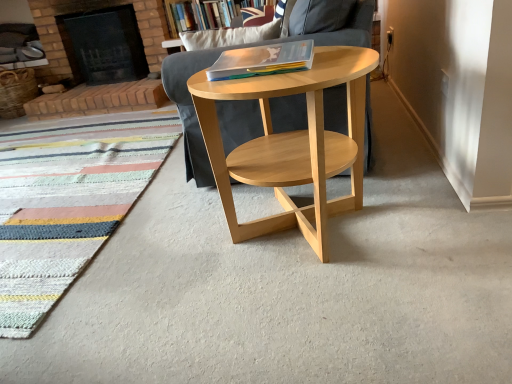
Measure the distance between natural wood chair at center and camera.

4.76 feet.

Where is `natural wood chair at center`? Image resolution: width=512 pixels, height=384 pixels. natural wood chair at center is located at coordinates (192, 105).

This screenshot has height=384, width=512. What do you see at coordinates (262, 61) in the screenshot?
I see `translucent plastic folder at center` at bounding box center [262, 61].

What is the approximate width of multicolored woven mat at lower left?

multicolored woven mat at lower left is 8.27 feet in width.

Describe the element at coordinates (104, 45) in the screenshot. The height and width of the screenshot is (384, 512). I see `brick fireplace at upper left` at that location.

This screenshot has height=384, width=512. I want to click on natural wood chair at center, so click(192, 105).

Can you confirm if multicolored woven mat at lower left is wider than brick fireplace at upper left?

Yes, multicolored woven mat at lower left is wider than brick fireplace at upper left.

Is the position of multicolored woven mat at lower left less distant than that of brick fireplace at upper left?

Yes, multicolored woven mat at lower left is closer to the camera.

Is multicolored woven mat at lower left next to brick fireplace at upper left?

No, multicolored woven mat at lower left is not next to brick fireplace at upper left.

Who is shorter, multicolored woven mat at lower left or brick fireplace at upper left?

multicolored woven mat at lower left is shorter.

Is point (189, 25) behind point (51, 167)?

That is False.

From a real-world perspective, which object stands above the other?

From a 3D spatial view, wooden bookshelf at upper center is above.

Considering the relative positions of wooden bookshelf at upper center and multicolored woven mat at lower left in the image provided, is wooden bookshelf at upper center behind multicolored woven mat at lower left?

That is True.

From the image's perspective, is wooden bookshelf at upper center located above or below multicolored woven mat at lower left?

Based on their image positions, wooden bookshelf at upper center is located above multicolored woven mat at lower left.

Based on the photo, how many degrees apart are the facing directions of natural wood chair at center and brick fireplace at upper left?

The angle between the facing direction of natural wood chair at center and the facing direction of brick fireplace at upper left is 90.2 degrees.

Is natural wood chair at center aimed at brick fireplace at upper left?

Yes, natural wood chair at center is facing brick fireplace at upper left.

At what (x,y) coordinates should I click in order to perform the action: click on fireplace behind the natural wood chair at center. Please return your answer as a coordinate pair (x, y). The height and width of the screenshot is (384, 512). Looking at the image, I should click on (104, 45).

How far apart are multicolored woven mat at lower left and wooden bookshelf at upper center?

They are 3.53 feet apart.

Which is more to the left, multicolored woven mat at lower left or wooden bookshelf at upper center?

Positioned to the left is multicolored woven mat at lower left.

From the image's perspective, is multicolored woven mat at lower left above or below wooden bookshelf at upper center?

From the image's perspective, multicolored woven mat at lower left appears below wooden bookshelf at upper center.

Which is in front, point (76, 155) or point (228, 6)?

The point (228, 6) is in front.

Is translucent plastic folder at center inside the boundaries of natural wood chair at center, or outside?

translucent plastic folder at center is located beyond the bounds of natural wood chair at center.

Locate an element on the screen. chair lying behind the translucent plastic folder at center is located at coordinates (192, 105).

Which object is positioned more to the right, translucent plastic folder at center or natural wood chair at center?

From the viewer's perspective, natural wood chair at center appears more on the right side.

Does natural wood chair at center have a greater width compared to wooden bookshelf at upper center?

Indeed, natural wood chair at center has a greater width compared to wooden bookshelf at upper center.

Considering the sizes of objects natural wood chair at center and wooden bookshelf at upper center in the image provided, who is bigger, natural wood chair at center or wooden bookshelf at upper center?

natural wood chair at center.

What are the coordinates of `chair below the wooden bookshelf at upper center (from a real-world perspective)` in the screenshot? It's located at (192, 105).

In the image, is natural wood chair at center positioned in front of or behind wooden bookshelf at upper center?

Clearly, natural wood chair at center is in front of wooden bookshelf at upper center.

Which of these two, natural wood chair at center or multicolored woven mat at lower left, is wider?

multicolored woven mat at lower left is wider.

From a real-world perspective, relative to multicolored woven mat at lower left, is natural wood chair at center vertically above or below?

From a real-world perspective, natural wood chair at center is physically above multicolored woven mat at lower left.

Where is `chair behind the multicolored woven mat at lower left`? This screenshot has width=512, height=384. chair behind the multicolored woven mat at lower left is located at coordinates (192, 105).

Would you say natural wood chair at center is outside multicolored woven mat at lower left?

Yes, natural wood chair at center is located beyond the bounds of multicolored woven mat at lower left.

This screenshot has height=384, width=512. I want to click on mat below the brick fireplace at upper left (from a real-world perspective), so click(68, 201).

This screenshot has width=512, height=384. In the image, there is a multicolored woven mat at lower left. What are the coordinates of `bookcase above it (from the image's perspective)` in the screenshot? It's located at pyautogui.click(x=211, y=13).

Looking at the image, which one is located further to brick fireplace at upper left, multicolored woven mat at lower left or wooden bookshelf at upper center?

The object further to brick fireplace at upper left is wooden bookshelf at upper center.

From the image, which object appears to be nearer to wooden bookshelf at upper center, multicolored woven mat at lower left or translucent plastic folder at center?

translucent plastic folder at center lies closer to wooden bookshelf at upper center than the other object.

Which object lies nearer to the anchor point translucent plastic folder at center, natural wood chair at center or brick fireplace at upper left?

natural wood chair at center.

Considering their positions, is multicolored woven mat at lower left positioned closer to translucent plastic folder at center than brick fireplace at upper left?

Based on the image, multicolored woven mat at lower left appears to be nearer to translucent plastic folder at center.

When comparing their distances from natural wood chair at center, does multicolored woven mat at lower left or translucent plastic folder at center seem further?

multicolored woven mat at lower left is further to natural wood chair at center.

When comparing their distances from wooden bookshelf at upper center, does translucent plastic folder at center or multicolored woven mat at lower left seem further?

The object further to wooden bookshelf at upper center is multicolored woven mat at lower left.

In the scene shown: Looking at the image, which one is located further to brick fireplace at upper left, translucent plastic folder at center or multicolored woven mat at lower left?

Among the two, translucent plastic folder at center is located further to brick fireplace at upper left.

Looking at the image, which one is located closer to wooden bookshelf at upper center, multicolored woven mat at lower left or brick fireplace at upper left?

Based on the image, multicolored woven mat at lower left appears to be nearer to wooden bookshelf at upper center.

Image resolution: width=512 pixels, height=384 pixels. What are the coordinates of `fireplace between natural wood chair at center and wooden bookshelf at upper center in the front-back direction` in the screenshot? It's located at (104, 45).

You are a GUI agent. You are given a task and a screenshot of the screen. Output one action in this format:
    pyautogui.click(x=<x>, y=<y>)
    Task: Click on the mat between translucent plastic folder at center and wooden bookshelf at upper center from front to back
    This screenshot has height=384, width=512.
    Given the screenshot: What is the action you would take?
    pyautogui.click(x=68, y=201)

Find the location of a particular element. This screenshot has width=512, height=384. fireplace positioned between translucent plastic folder at center and wooden bookshelf at upper center from near to far is located at coordinates (104, 45).

Find the location of a particular element. Image resolution: width=512 pixels, height=384 pixels. chair between multicolored woven mat at lower left and brick fireplace at upper left in the front-back direction is located at coordinates (192, 105).